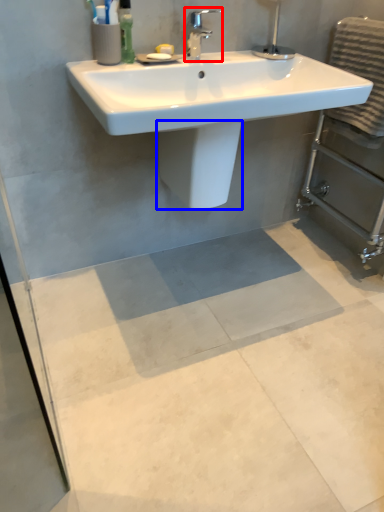
Question: Which point is further to the camera, tap (highlighted by a red box) or bidet (highlighted by a blue box)?

Choices:
 (A) tap
 (B) bidet

Answer: (B)